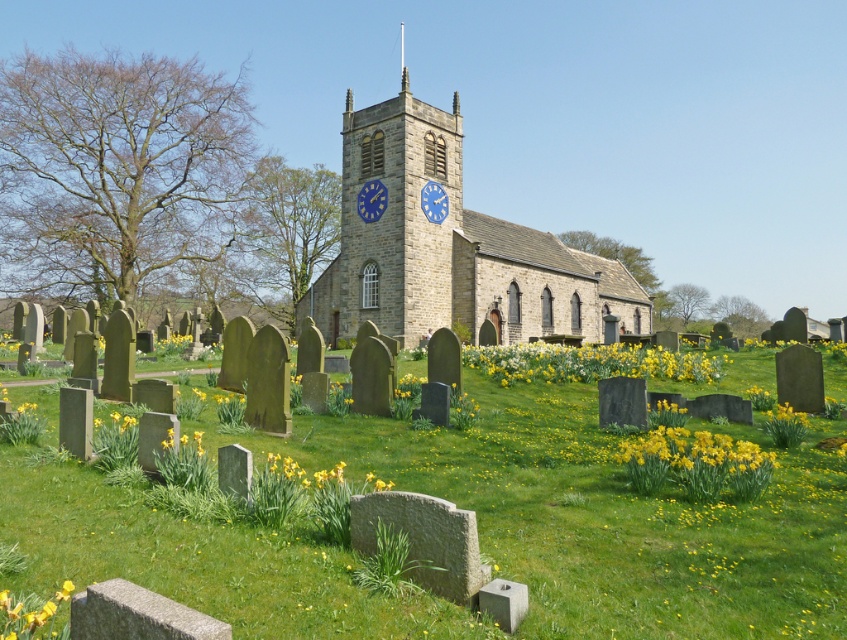
You are standing at the point marked as point [617,364] in the image. You want to take a photo of the church with the graveyard in the background. Is the distance from your current position to the camera sufficient to include both the church and the graveyard in the frame?

The distance of point [617,364] from camera is 57.45 feet. Since you are at that point, the camera is 57.45 feet away from you. To capture both the church and the graveyard in the background, the camera needs to be positioned far enough to encompass both elements. However, the given distance specifies your position relative to the camera, not the church or graveyard. Without knowing the distance between the church, graveyard, and your position, it is impossible to determine if the camera can capture both

You are standing at the point with coordinates (447, 244) in the image. Which object is exactly at your current location?

The stone church at center is exactly at your current location at point (447, 244).

You are standing at the entrance of the graveyard and want to take a photo of the stone church at center. Which direction should you face to capture the church in your camera view?

Since the stone church at center is located at point (447, 244), you should face towards the center of the image to capture it in your photo.